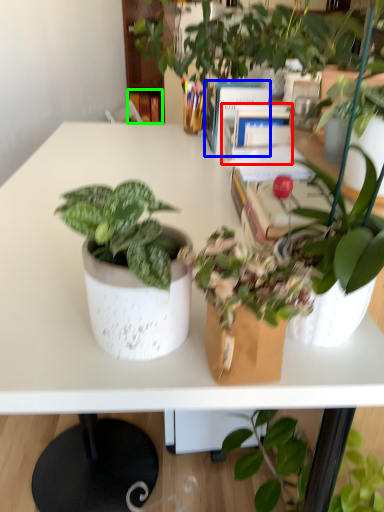
Question: Which is farther away from book (highlighted by a red box)? book (highlighted by a blue box) or book (highlighted by a green box)?

Choices:
 (A) book
 (B) book

Answer: (B)